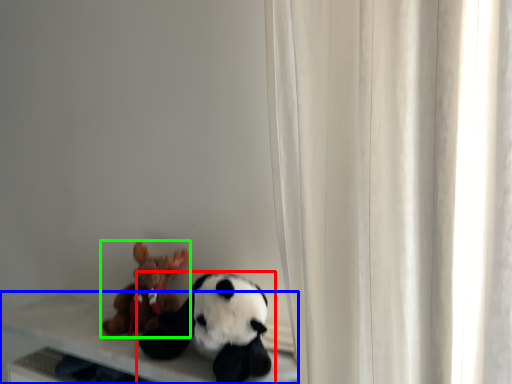
Question: Which object is positioned farthest from toy (highlighted by a red box)? Select from table (highlighted by a blue box) and toy (highlighted by a green box).

Choices:
 (A) table
 (B) toy

Answer: (B)